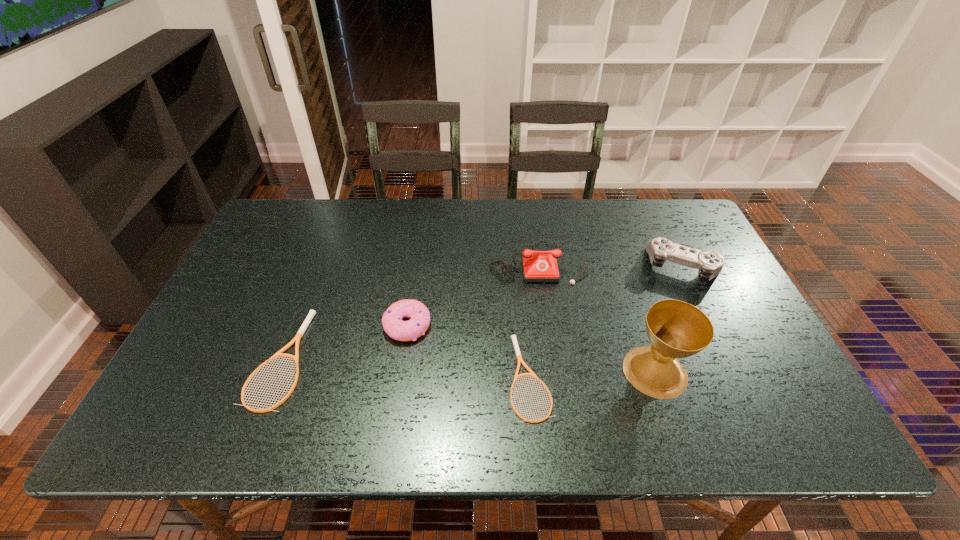
Locate an element on the screen. vacant area in the image that satisfies the following two spatial constraints: 1. on the dial of the chalice; 2. on the left side of the telephone is located at coordinates (553, 372).